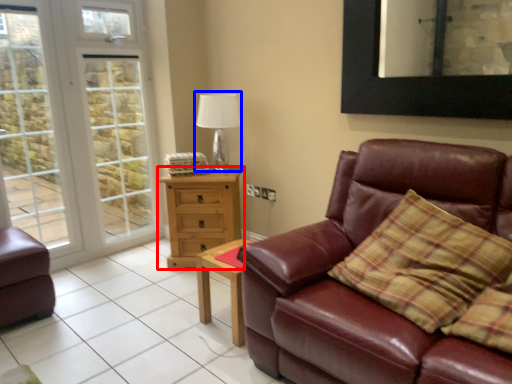
Question: Which point is further to the camera, chest of drawers (highlighted by a red box) or table lamp (highlighted by a blue box)?

Choices:
 (A) chest of drawers
 (B) table lamp

Answer: (B)